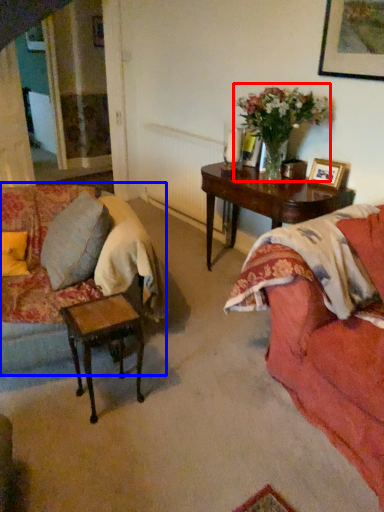
Question: Among these objects, which one is farthest to the camera, floral arrangement (highlighted by a red box) or studio couch (highlighted by a blue box)?

Choices:
 (A) floral arrangement
 (B) studio couch

Answer: (A)